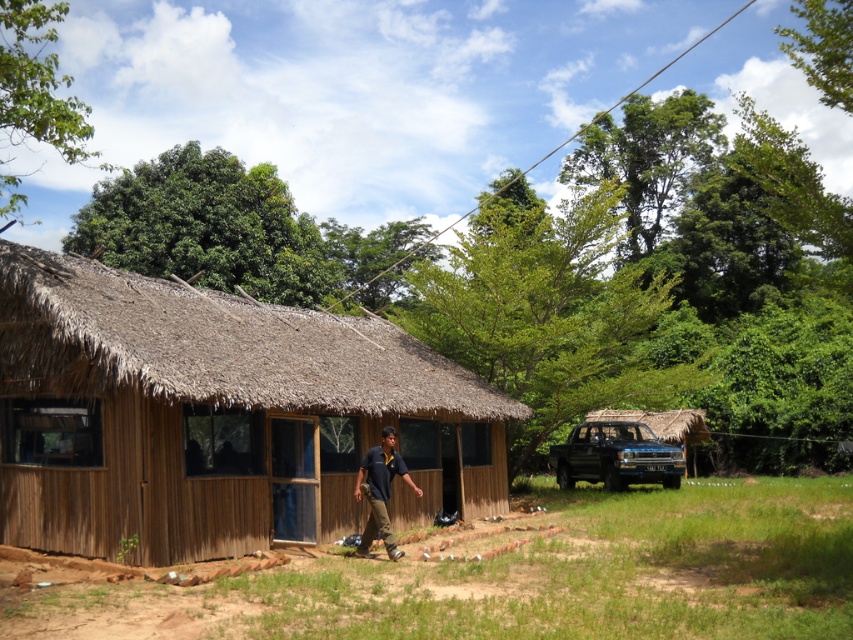
Question: Is brown thatch at center positioned at the back of dark brown uniform at center?

Choices:
 (A) yes
 (B) no

Answer: (B)

Question: Which object is positioned farthest from the brown thatch at center?

Choices:
 (A) black matte jeep at center
 (B) thatched straw hut at right

Answer: (B)

Question: From the image, what is the correct spatial relationship of black matte jeep at center in relation to dark brown uniform at center?

Choices:
 (A) left
 (B) right

Answer: (B)

Question: Considering the real-world distances, which object is closest to the thatched straw hut at right?

Choices:
 (A) dark brown uniform at center
 (B) black matte jeep at center

Answer: (B)

Question: Which object appears farthest from the camera in this image?

Choices:
 (A) thatched straw hut at right
 (B) black matte jeep at center
 (C) brown thatch at center
 (D) dark brown uniform at center

Answer: (A)

Question: Is black matte jeep at center closer to the viewer compared to dark brown uniform at center?

Choices:
 (A) no
 (B) yes

Answer: (A)